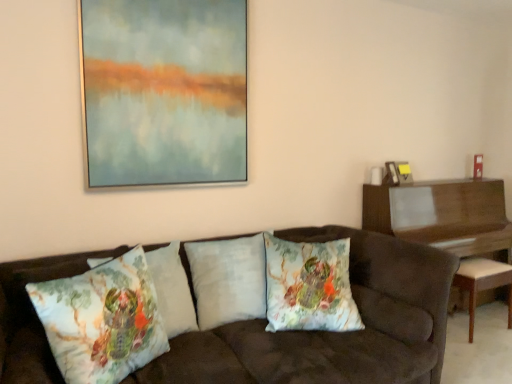
Locate an element on the screen. floral-patterned fabric pillow at center, the first pillow viewed from the left is located at coordinates (102, 320).

I want to click on floral-patterned fabric pillow at center, acting as the 3th pillow starting from the right, so click(172, 289).

What do you see at coordinates (403, 172) in the screenshot? I see `metallic gold picture frame at upper right, which is the third picture frame in front-to-back order` at bounding box center [403, 172].

At what (x,y) coordinates should I click in order to perform the action: click on metallic silver picture frame at upper right, which appears as the 2th picture frame when viewed from the front. Please return your answer as a coordinate pair (x, y). This screenshot has width=512, height=384. Looking at the image, I should click on (391, 173).

Locate an element on the screen. The width and height of the screenshot is (512, 384). wooden piano at right is located at coordinates (443, 215).

What is the approximate height of suede couch at center?

suede couch at center is 34.74 inches tall.

Where is `matte glass painting at upper center, which is the third picture frame in right-to-left order`? This screenshot has height=384, width=512. matte glass painting at upper center, which is the third picture frame in right-to-left order is located at coordinates (164, 92).

I want to click on floral-patterned fabric pillow at center, positioned as the fourth pillow in right-to-left order, so click(102, 320).

Is white fabric stool at right beside metallic silver picture frame at upper right, acting as the second picture frame starting from the left?

No, white fabric stool at right is not touching metallic silver picture frame at upper right, acting as the second picture frame starting from the left.

Would you say white fabric stool at right is outside metallic silver picture frame at upper right, the second picture frame viewed from the right?

Yes.

The height and width of the screenshot is (384, 512). Identify the location of table that is under the metallic silver picture frame at upper right, acting as the second picture frame starting from the left (from a real-world perspective). (443, 215).

From the picture: From a real-world perspective, is wooden piano at right positioned above or below metallic silver picture frame at upper right, the second picture frame viewed from the back?

wooden piano at right is below metallic silver picture frame at upper right, the second picture frame viewed from the back.

Between wooden piano at right and metallic silver picture frame at upper right, the second picture frame viewed from the right, which one has smaller size?

metallic silver picture frame at upper right, the second picture frame viewed from the right, is smaller.

Is point (106, 355) positioned in front of point (197, 47)?

Yes, it is.

Considering the positions of objects floral-patterned fabric pillow at center, the first pillow viewed from the left, and matte glass painting at upper center, the first picture frame from the front, in the image provided, who is behind, floral-patterned fabric pillow at center, the first pillow viewed from the left, or matte glass painting at upper center, the first picture frame from the front,?

matte glass painting at upper center, the first picture frame from the front, is behind.

Considering the relative positions of floral-patterned fabric pillow at center, the first pillow viewed from the left, and matte glass painting at upper center, which is the third picture frame in right-to-left order, in the image provided, is floral-patterned fabric pillow at center, the first pillow viewed from the left, to the left of matte glass painting at upper center, which is the third picture frame in right-to-left order, from the viewer's perspective?

Yes, floral-patterned fabric pillow at center, the first pillow viewed from the left, is to the left of matte glass painting at upper center, which is the third picture frame in right-to-left order.

From the picture: From a real-world perspective, is floral-patterned fabric pillow at center, which is the second pillow in left-to-right order, over suede couch at center?

Correct, in the physical world, floral-patterned fabric pillow at center, which is the second pillow in left-to-right order, is higher than suede couch at center.

What's the angular difference between floral-patterned fabric pillow at center, acting as the 3th pillow starting from the right, and suede couch at center's facing directions?

22 degrees.

Find the location of a particular element. The height and width of the screenshot is (384, 512). the 3rd pillow above the suede couch at center (from a real-world perspective) is located at coordinates [x=172, y=289].

Does floral-patterned fabric pillow at center, acting as the 3th pillow starting from the right, come behind suede couch at center?

Yes, it is behind suede couch at center.

Considering the sizes of objects white fabric stool at right and floral cotton cushion at center, positioned as the 1th pillow in right-to-left order, in the image provided, who is wider, white fabric stool at right or floral cotton cushion at center, positioned as the 1th pillow in right-to-left order,?

white fabric stool at right is wider.

From a real-world perspective, which pillow is the 1st one above the white fabric stool at right? Please provide its 2D coordinates.

[(309, 286)]

Does point (479, 277) appear closer or farther from the camera than point (269, 330)?

Point (479, 277) is farther from the camera than point (269, 330).

Is white fabric stool at right positioned beyond the bounds of floral cotton cushion at center, acting as the fourth pillow starting from the left?

Yes.

From the image's perspective, is metallic gold picture frame at upper right, the 3th picture frame positioned from the left, above or below wooden piano at right?

Based on their image positions, metallic gold picture frame at upper right, the 3th picture frame positioned from the left, is located above wooden piano at right.

Can you tell me how much metallic gold picture frame at upper right, which appears as the 1th picture frame when viewed from the right, and wooden piano at right differ in facing direction?

metallic gold picture frame at upper right, which appears as the 1th picture frame when viewed from the right, and wooden piano at right are facing 0.177 degrees away from each other.

Is metallic gold picture frame at upper right, the 3th picture frame positioned from the left, outside of wooden piano at right?

metallic gold picture frame at upper right, the 3th picture frame positioned from the left, is positioned outside wooden piano at right.

The image size is (512, 384). In order to click on table below the metallic gold picture frame at upper right, which is the third picture frame in front-to-back order (from the image's perspective) in this screenshot , I will do `click(443, 215)`.

Is floral-patterned fabric pillow at center, acting as the 3th pillow starting from the right, not within matte glass painting at upper center, the 1th picture frame in the left-to-right sequence?

floral-patterned fabric pillow at center, acting as the 3th pillow starting from the right, is positioned outside matte glass painting at upper center, the 1th picture frame in the left-to-right sequence.

Considering the sizes of objects floral-patterned fabric pillow at center, which is the second pillow in left-to-right order, and matte glass painting at upper center, which is the third picture frame in right-to-left order, in the image provided, who is thinner, floral-patterned fabric pillow at center, which is the second pillow in left-to-right order, or matte glass painting at upper center, which is the third picture frame in right-to-left order,?

With smaller width is matte glass painting at upper center, which is the third picture frame in right-to-left order.

From a real-world perspective, is floral-patterned fabric pillow at center, which is the second pillow in left-to-right order, physically below matte glass painting at upper center, the first picture frame from the front?

Yes, from a real-world perspective, floral-patterned fabric pillow at center, which is the second pillow in left-to-right order, is below matte glass painting at upper center, the first picture frame from the front.

Looking at this image, can you confirm if floral-patterned fabric pillow at center, which is the second pillow in left-to-right order, is smaller than matte glass painting at upper center, which is the third picture frame from back to front?

Incorrect, floral-patterned fabric pillow at center, which is the second pillow in left-to-right order, is not smaller in size than matte glass painting at upper center, which is the third picture frame from back to front.

Locate an element on the screen. This screenshot has height=384, width=512. stool that is below the metallic silver picture frame at upper right, the second picture frame viewed from the right (from the image's perspective) is located at coordinates (483, 283).

Locate an element on the screen. The width and height of the screenshot is (512, 384). table lying in front of the metallic silver picture frame at upper right, which appears as the 2th picture frame when viewed from the front is located at coordinates (443, 215).

From the image, which object appears to be farther from matte glass painting at upper center, which is the third picture frame from back to front, light blue fabric pillow at center, marked as the second pillow in a right-to-left arrangement, or white fabric stool at right?

Among the two, white fabric stool at right is located further to matte glass painting at upper center, which is the third picture frame from back to front.

From the image, which object appears to be farther from metallic silver picture frame at upper right, which appears as the 2th picture frame when viewed from the front, floral-patterned fabric pillow at center, which is the second pillow in left-to-right order, or metallic gold picture frame at upper right, which appears as the 1th picture frame when viewed from the right?

floral-patterned fabric pillow at center, which is the second pillow in left-to-right order, lies further to metallic silver picture frame at upper right, which appears as the 2th picture frame when viewed from the front, than the other object.

Looking at the image, which one is located further to suede couch at center, wooden piano at right or metallic gold picture frame at upper right, the 3th picture frame positioned from the left?

metallic gold picture frame at upper right, the 3th picture frame positioned from the left, is positioned further to the anchor suede couch at center.

Looking at the image, which one is located closer to metallic silver picture frame at upper right, which appears as the 2th picture frame when viewed from the front, matte glass painting at upper center, the first picture frame from the front, or wooden piano at right?

wooden piano at right lies closer to metallic silver picture frame at upper right, which appears as the 2th picture frame when viewed from the front, than the other object.

Considering their positions, is suede couch at center positioned closer to wooden piano at right than floral-patterned fabric pillow at center, the first pillow viewed from the left?

suede couch at center lies closer to wooden piano at right than the other object.

Looking at the image, which one is located further to floral-patterned fabric pillow at center, which is the second pillow in left-to-right order, metallic gold picture frame at upper right, the 3th picture frame positioned from the left, or floral-patterned fabric pillow at center, positioned as the fourth pillow in right-to-left order?

metallic gold picture frame at upper right, the 3th picture frame positioned from the left, is further to floral-patterned fabric pillow at center, which is the second pillow in left-to-right order.

Estimate the real-world distances between objects in this image. Which object is closer to suede couch at center, metallic gold picture frame at upper right, which appears as the 1th picture frame when viewed from the right, or metallic silver picture frame at upper right, the second picture frame viewed from the right?

metallic silver picture frame at upper right, the second picture frame viewed from the right, is positioned closer to the anchor suede couch at center.

Considering their positions, is floral-patterned fabric pillow at center, which is the second pillow in left-to-right order, positioned further to metallic gold picture frame at upper right, positioned as the first picture frame in back-to-front order, than matte glass painting at upper center, the first picture frame from the front?

The object further to metallic gold picture frame at upper right, positioned as the first picture frame in back-to-front order, is floral-patterned fabric pillow at center, which is the second pillow in left-to-right order.

Find the location of a particular element. The image size is (512, 384). pillow situated between light blue fabric pillow at center, which ranks as the 3th pillow in left-to-right order, and metallic silver picture frame at upper right, acting as the second picture frame starting from the left, from left to right is located at coordinates (309, 286).

This screenshot has height=384, width=512. I want to click on pillow between matte glass painting at upper center, which is the third picture frame in right-to-left order, and floral cotton cushion at center, positioned as the 1th pillow in right-to-left order, in the up-down direction, so click(228, 279).

You are a GUI agent. You are given a task and a screenshot of the screen. Output one action in this format:
    pyautogui.click(x=<x>, y=<y>)
    Task: Click on the table between metallic gold picture frame at upper right, which is the third picture frame in front-to-back order, and white fabric stool at right in the up-down direction
    
    Given the screenshot: What is the action you would take?
    pyautogui.click(x=443, y=215)

Find the location of `studio couch situated between floral-patterned fabric pillow at center, the first pillow viewed from the left, and white fabric stool at right from left to right`. studio couch situated between floral-patterned fabric pillow at center, the first pillow viewed from the left, and white fabric stool at right from left to right is located at coordinates (333, 332).